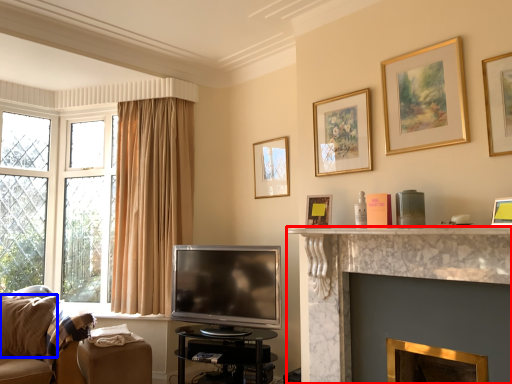
Question: Which of the following is the farthest to the observer, fireplace (highlighted by a red box) or pillow (highlighted by a blue box)?

Choices:
 (A) fireplace
 (B) pillow

Answer: (B)